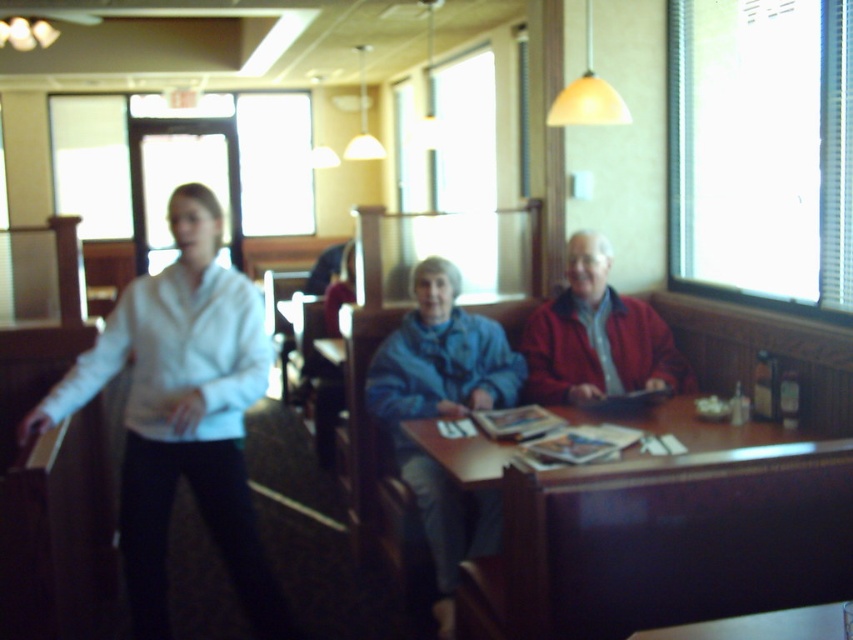
Question: Is white matte shirt at left further to camera compared to red matte jacket at center?

Choices:
 (A) yes
 (B) no

Answer: (B)

Question: Is white matte shirt at left above red matte jacket at center?

Choices:
 (A) yes
 (B) no

Answer: (B)

Question: Based on their relative distances, which object is nearer to the wooden table at center?

Choices:
 (A) red matte jacket at center
 (B) blue fleece jacket at center
 (C) white matte shirt at left

Answer: (B)

Question: Among these points, which one is nearest to the camera?

Choices:
 (A) (599, 276)
 (B) (598, 572)
 (C) (241, 404)

Answer: (B)

Question: Observing the image, what is the correct spatial positioning of blue fleece jacket at center in reference to red matte jacket at center?

Choices:
 (A) above
 (B) below

Answer: (B)

Question: Considering the real-world distances, which object is farthest from the white matte shirt at left?

Choices:
 (A) red matte jacket at center
 (B) wooden table at center

Answer: (A)